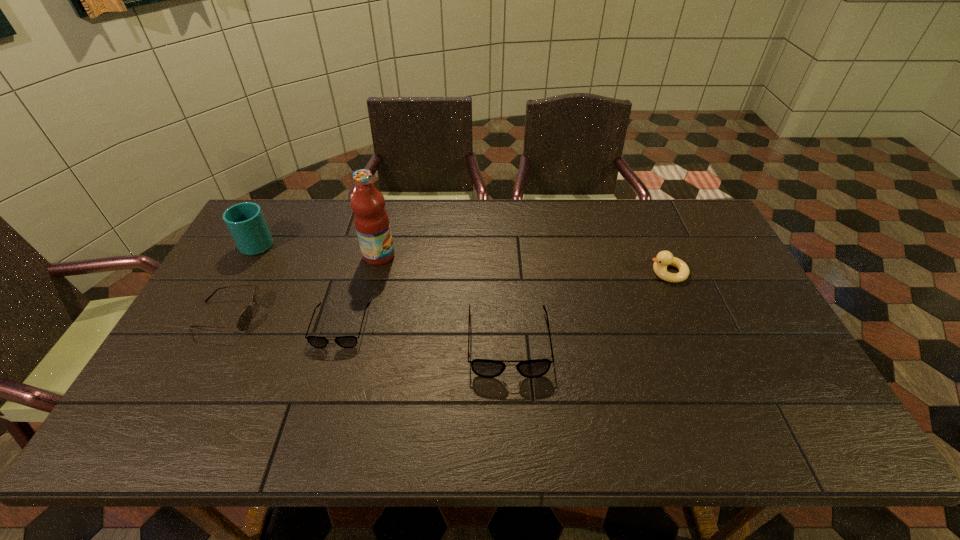
Find the location of a particular element. The width and height of the screenshot is (960, 540). the shortest object is located at coordinates (316, 341).

This screenshot has height=540, width=960. Find the location of `the shorter spectacles`. the shorter spectacles is located at coordinates (316, 341).

Locate an element on the screen. the right spectacles is located at coordinates (486, 368).

I want to click on the fifth object from left to right, so click(x=486, y=368).

I want to click on the fifth shortest object, so click(x=245, y=221).

Identify the location of the rightmost object. The height and width of the screenshot is (540, 960). (664, 258).

At what (x,y) coordinates should I click in order to perform the action: click on fruit juice. Please return your answer as a coordinate pair (x, y). Looking at the image, I should click on (371, 220).

You are a GUI agent. You are given a task and a screenshot of the screen. Output one action in this format:
    pyautogui.click(x=<x>, y=<y>)
    Task: Click on the sunglasses
    The width and height of the screenshot is (960, 540).
    Given the screenshot: What is the action you would take?
    pyautogui.click(x=243, y=322)

Find the location of a particular element. Image resolution: width=960 pixels, height=540 pixels. vacant area situated 0.140m on the front-facing side of the left spectacles is located at coordinates (321, 397).

This screenshot has height=540, width=960. In order to click on vacant space located 0.090m on the handle side of the second tallest object in this screenshot , I will do `click(275, 213)`.